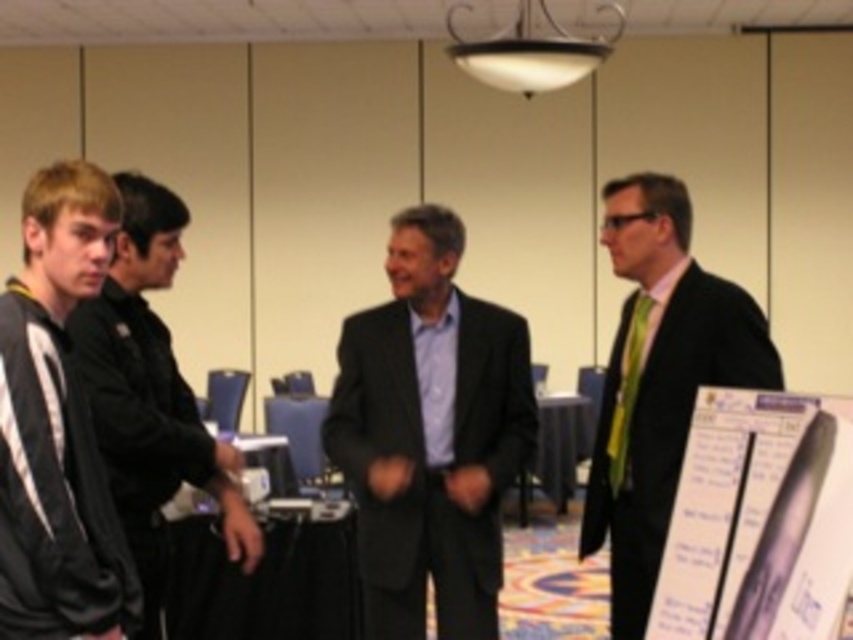
Question: Is black fleece jacket at left thinner than white paper at lower right?

Choices:
 (A) no
 (B) yes

Answer: (A)

Question: Which is farther from the black jacket at left?

Choices:
 (A) matte black suit at right
 (B) dark gray suit at center
 (C) white paper at lower right
 (D) black fleece jacket at left

Answer: (C)

Question: Is black fleece jacket at left closer to the viewer compared to matte black suit at right?

Choices:
 (A) no
 (B) yes

Answer: (B)

Question: Which object appears farthest from the camera in this image?

Choices:
 (A) black fleece jacket at left
 (B) dark gray suit at center
 (C) matte black suit at right

Answer: (B)

Question: Which is farther from the black jacket at left?

Choices:
 (A) black fleece jacket at left
 (B) white paper at lower right
 (C) matte black suit at right

Answer: (B)

Question: Does black fleece jacket at left appear over white paper at lower right?

Choices:
 (A) yes
 (B) no

Answer: (A)